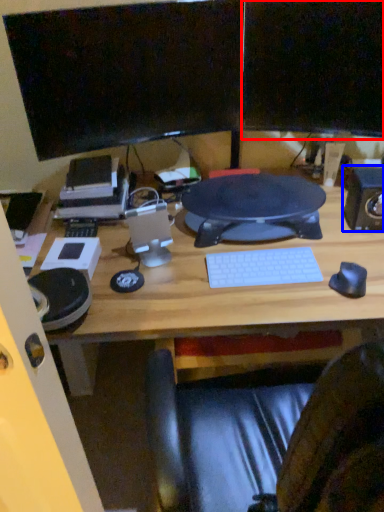
Question: Which point is closer to the camera, computer monitor (highlighted by a red box) or speaker (highlighted by a blue box)?

Choices:
 (A) computer monitor
 (B) speaker

Answer: (A)